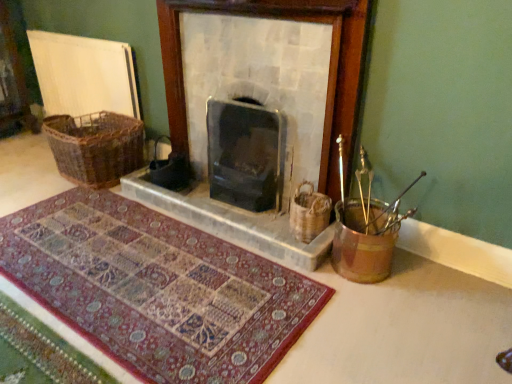
Question: In terms of width, does woven brown basket at left, the first basket when ordered from back to front, look wider or thinner when compared to metallic gold bucket at right?

Choices:
 (A) thin
 (B) wide

Answer: (B)

Question: Do you think woven brown basket at left, which is the first basket from top to bottom, is within metallic gold bucket at right, or outside of it?

Choices:
 (A) outside
 (B) inside

Answer: (A)

Question: Based on their relative distances, which object is farther from the woven brown basket at left, the 1th basket when ordered from left to right?

Choices:
 (A) carpeted mat at center
 (B) woven brown basket at right, the second basket when ordered from back to front
 (C) metallic gold bucket at right
 (D) stone fireplace at center
 (E) black glass wood burning stove at center

Answer: (C)

Question: Which object is positioned closest to the woven brown basket at left, the second basket viewed from the right?

Choices:
 (A) black glass wood burning stove at center
 (B) carpeted mat at center
 (C) woven brown basket at right, marked as the first basket in a right-to-left arrangement
 (D) stone fireplace at center
 (E) metallic gold bucket at right

Answer: (D)